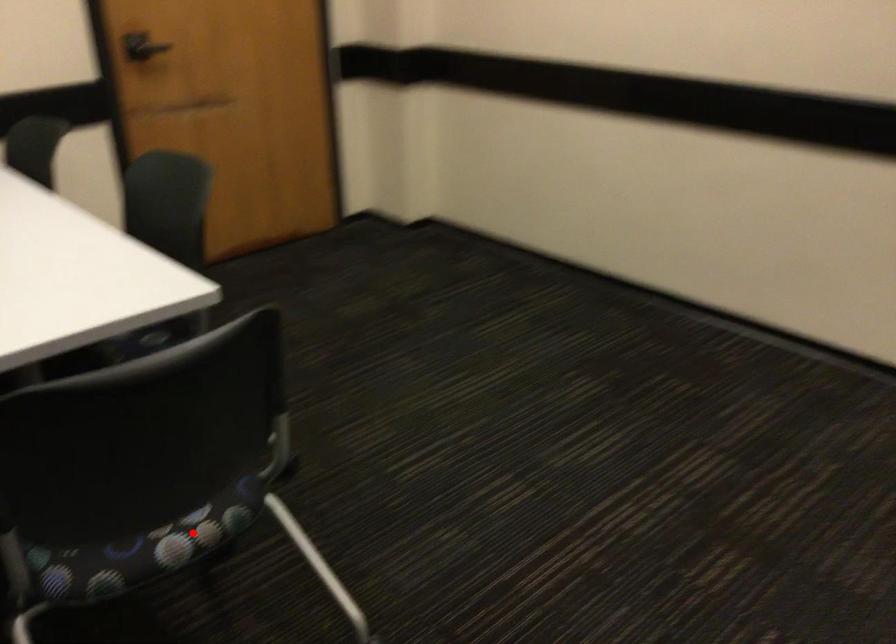
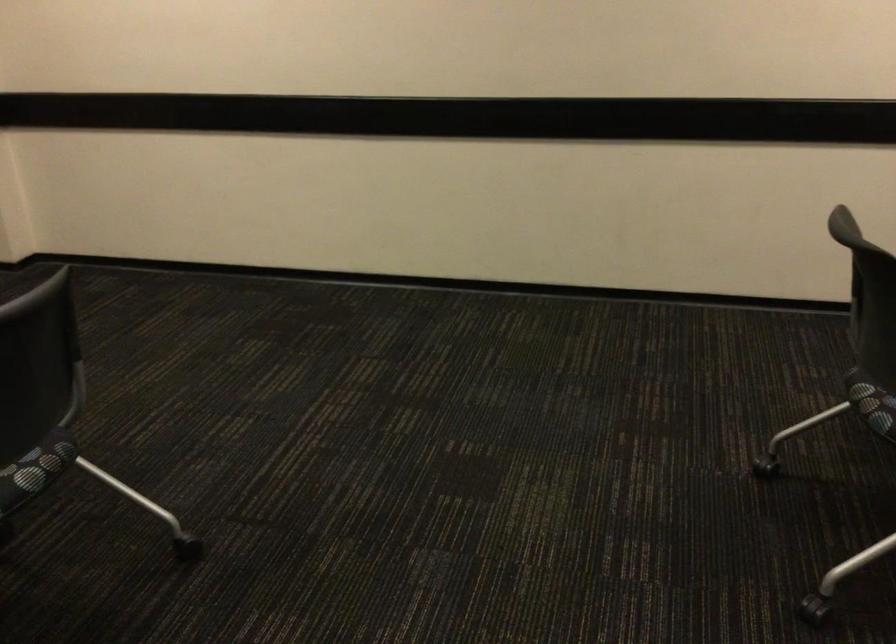
Where in the second image is the point corresponding to the highlighted location from the first image?

(40, 462)